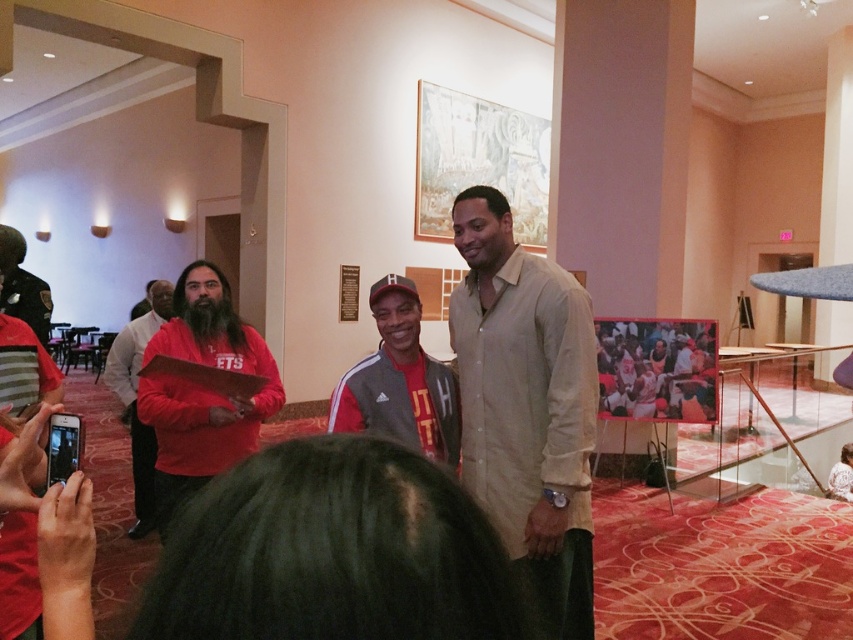
You are at an event and want to take a photo with the beige cotton shirt at center and the red matte jacket at center. Since you can only focus on one of them, which one should you aim for to ensure both are in the frame?

The beige cotton shirt at center is located above the red matte jacket at center, so aiming for the beige cotton shirt at center would ensure both are in the frame as it is positioned higher.

You are at an event and see two people wearing red jackets at the center of the image. Which jacket is shorter in height between the red adidas jacket at center and the red matte jacket at center?

The red adidas jacket at center has a lesser height compared to the red matte jacket at center, so the red adidas jacket at center is shorter in height.